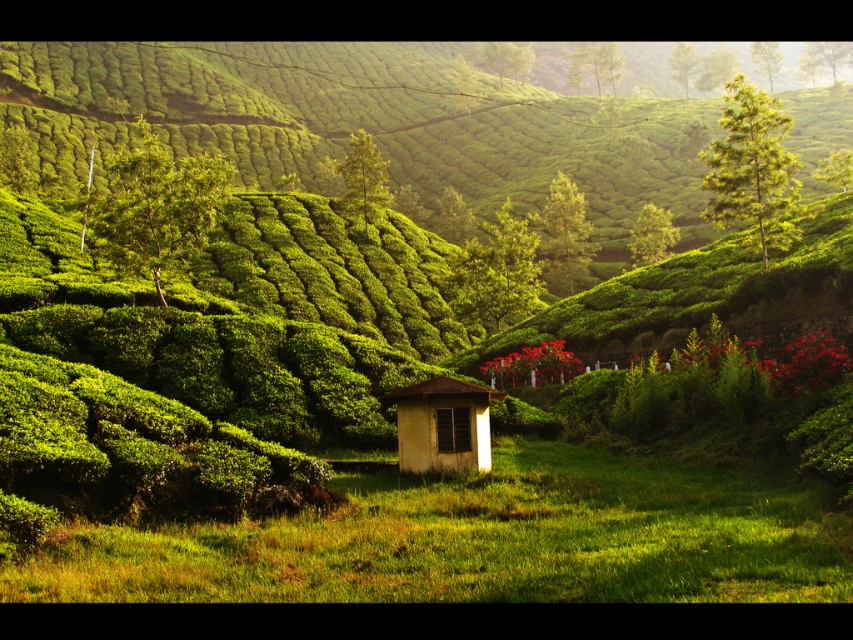
Does green grassy field at center have a lesser height compared to green leafy tree at upper right?

Yes, green grassy field at center is shorter than green leafy tree at upper right.

Who is taller, green grassy field at center or green leafy tree at upper right?

green leafy tree at upper right is taller.

Which is in front, point (132, 547) or point (732, 132)?

Positioned in front is point (132, 547).

Find the location of a particular element. The image size is (853, 640). green grassy field at center is located at coordinates (x=485, y=540).

Identify the location of green leafy hillside at center. (375, 120).

Does green leafy hillside at center appear on the right side of white matte gazebo at center?

Yes, green leafy hillside at center is to the right of white matte gazebo at center.

Who is more forward, (494,145) or (447,404)?

Positioned in front is point (447,404).

Find the location of a particular element. The image size is (853, 640). green leafy hillside at center is located at coordinates (375, 120).

Is green grassy field at center thinner than white matte gazebo at center?

No.

Between green grassy field at center and white matte gazebo at center, which one is positioned lower?

green grassy field at center

Measure the distance between green grassy field at center and camera.

green grassy field at center is 9.64 meters from camera.

Where is `green grassy field at center`? This screenshot has width=853, height=640. green grassy field at center is located at coordinates (485, 540).